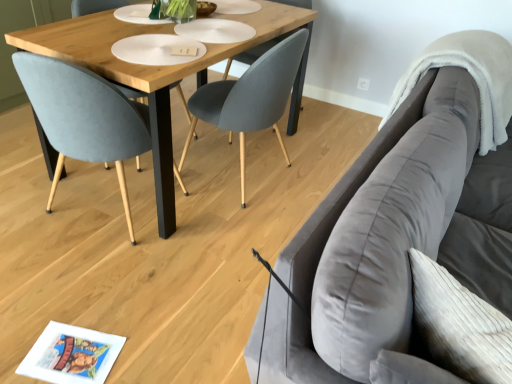
Where is `vacant region to the right of velvet blue chair at center, which appears as the 1th chair when viewed from the left`? This screenshot has width=512, height=384. vacant region to the right of velvet blue chair at center, which appears as the 1th chair when viewed from the left is located at coordinates (211, 248).